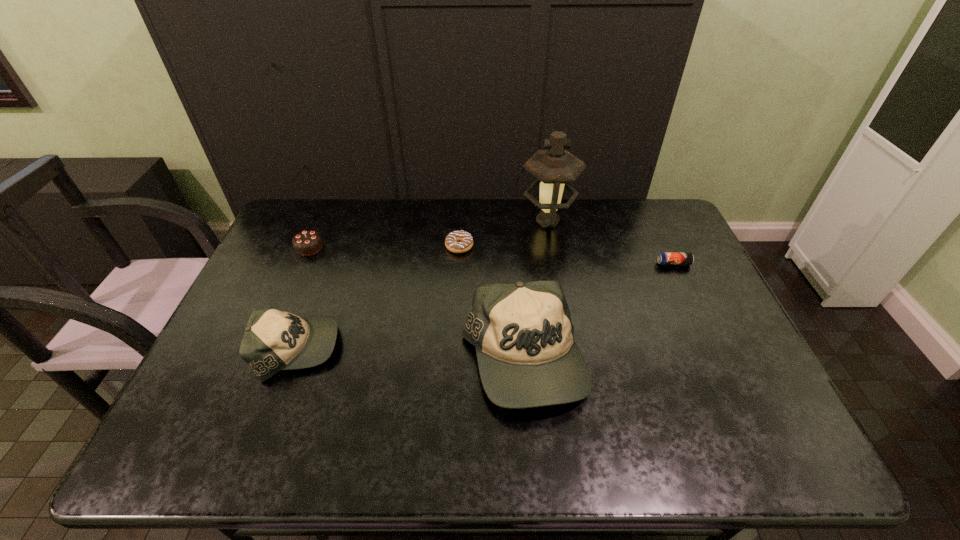
What are the coordinates of `vacant space located on the front-facing side of the shorter baseball cap` in the screenshot? It's located at (366, 349).

Where is `free space located 0.170m on the front of the oil lamp`? free space located 0.170m on the front of the oil lamp is located at coordinates (557, 271).

The width and height of the screenshot is (960, 540). Find the location of `free region located 0.170m on the back of the rightmost object`. free region located 0.170m on the back of the rightmost object is located at coordinates (657, 227).

Where is `blank space located 0.360m on the left of the doughnut`? This screenshot has width=960, height=540. blank space located 0.360m on the left of the doughnut is located at coordinates (336, 246).

Identify the location of vacant area situated on the right of the chocolate cake. The height and width of the screenshot is (540, 960). (366, 247).

I want to click on oil lamp that is at the far edge, so click(556, 167).

You are a GUI agent. You are given a task and a screenshot of the screen. Output one action in this format:
    pyautogui.click(x=<x>, y=<y>)
    Task: Click on the doughnut that is positioned at the far edge
    The height and width of the screenshot is (540, 960).
    Given the screenshot: What is the action you would take?
    pyautogui.click(x=458, y=241)

At what (x,y) coordinates should I click in order to perform the action: click on chocolate cake located at the far edge. Please return your answer as a coordinate pair (x, y). The width and height of the screenshot is (960, 540). Looking at the image, I should click on (307, 242).

The image size is (960, 540). What are the coordinates of `baseball cap present at the left edge` in the screenshot? It's located at (273, 340).

This screenshot has width=960, height=540. Identify the location of chocolate cake present at the left edge. (307, 242).